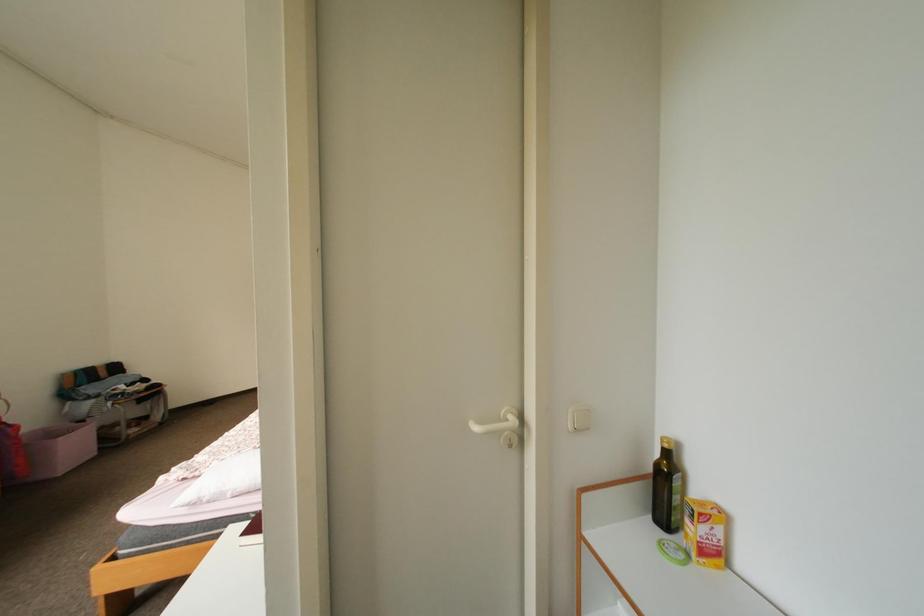
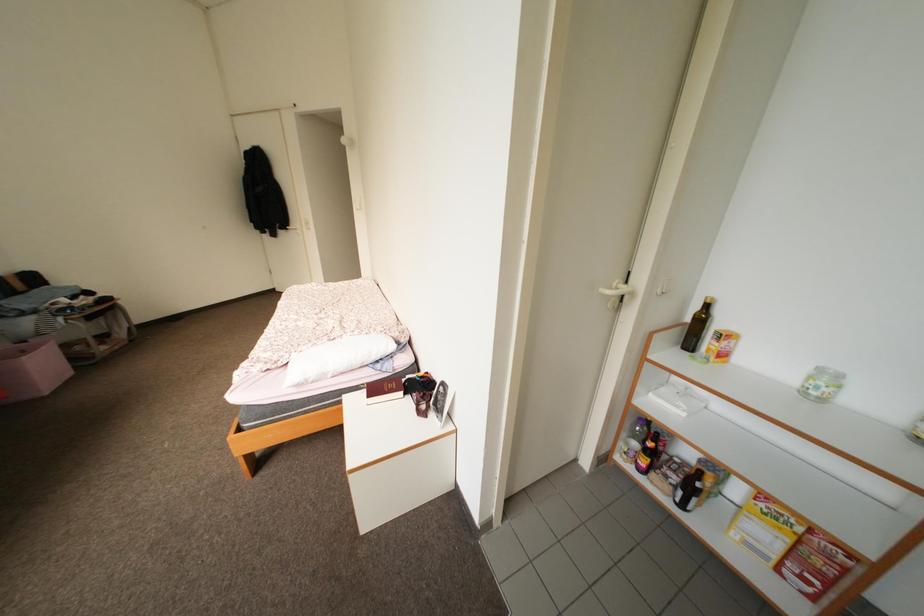
Question: The first image is from the beginning of the video and the second image is from the end. How did the camera likely rotate when shooting the video?

Choices:
 (A) Left
 (B) Right
 (C) Up
 (D) Down

Answer: (D)